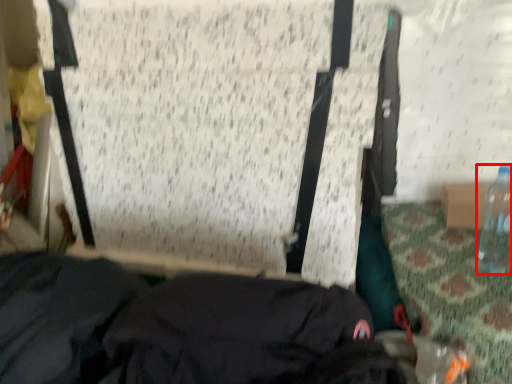
Question: From the image's perspective, where is bottle (annotated by the red box) located in relation to clothing in the image?

Choices:
 (A) below
 (B) above

Answer: (B)